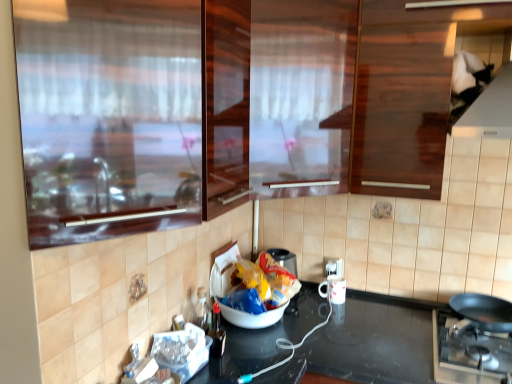
Question: Would you say transparent glossy glass door at upper center, the 1th glass door positioned from the back, is inside or outside brown glossy cabinet at upper center?

Choices:
 (A) outside
 (B) inside

Answer: (B)

Question: Based on their positions, is transparent glossy glass door at upper center, the 1th glass door positioned from the back, located to the left or right of brown glossy cabinet at upper center?

Choices:
 (A) right
 (B) left

Answer: (B)

Question: Estimate the real-world distances between objects in this image. Which object is closer to the white glossy mug at lower center?

Choices:
 (A) transparent glass door at upper left, which ranks as the second glass door in back-to-front order
 (B) black matte pan at lower right
 (C) yellow plastic bag at center
 (D) transparent glossy glass door at upper center, the 1th glass door positioned from the back
 (E) white plastic electric outlet at lower right

Answer: (E)

Question: Which object is the closest to the black matte pan at lower right?

Choices:
 (A) transparent glass door at upper left, which ranks as the second glass door in back-to-front order
 (B) black glossy countertop at center
 (C) yellow plastic bag at center
 (D) white glossy mug at lower center
 (E) white plastic electric outlet at lower right

Answer: (B)